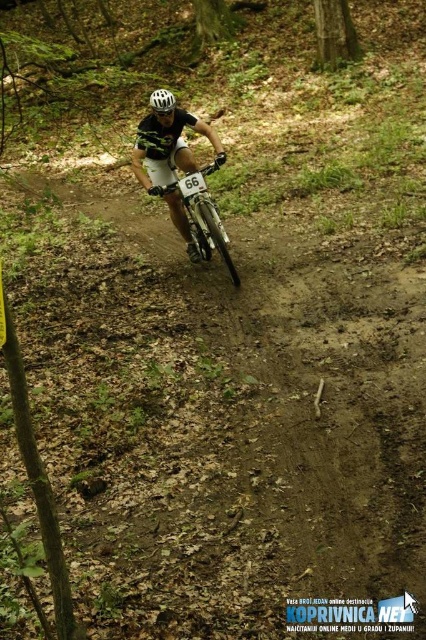
Between point (270, 406) and point (210, 134), which one is positioned behind?

Positioned behind is point (210, 134).

Does brown dirt track at center lie in front of matte black helmet at center?

Yes.

Between point (365, 474) and point (141, 140), which one is positioned behind?

Point (141, 140)

In order to click on brown dirt track at center in this screenshot , I will do `click(219, 417)`.

Is shiny metallic bicycle at center above white matte bicycle helmet at center?

No.

Who is positioned more to the right, shiny metallic bicycle at center or white matte bicycle helmet at center?

Positioned to the right is shiny metallic bicycle at center.

Which is in front, point (210, 205) or point (155, 90)?

Point (210, 205)

Locate an element on the screen. This screenshot has width=426, height=640. shiny metallic bicycle at center is located at coordinates (201, 212).

Between point (98, 524) and point (192, 234), which one is positioned in front?

Point (98, 524)

Is point (88, 330) in front of point (233, 268)?

That is True.

Locate an element on the screen. brown dirt track at center is located at coordinates (219, 417).

Locate an element on the screen. This screenshot has width=426, height=640. brown dirt track at center is located at coordinates (219, 417).